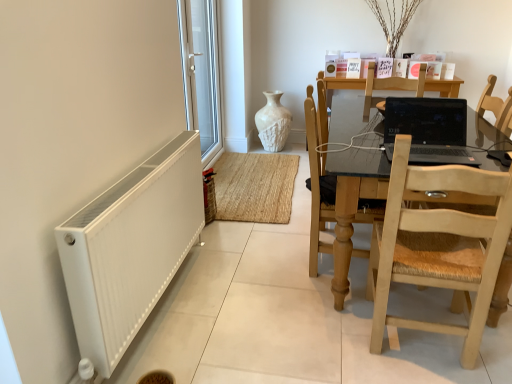
Find the location of a particular element. free space to the left of light brown wooden chair at center, the first chair from the back is located at coordinates click(270, 261).